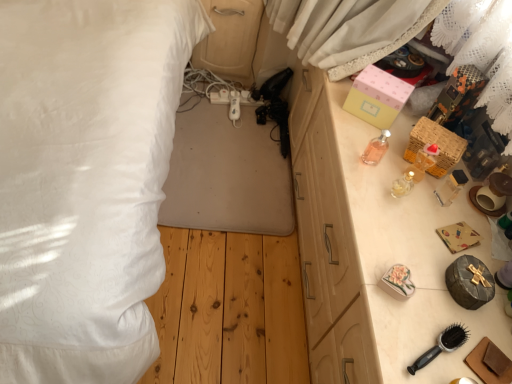
The width and height of the screenshot is (512, 384). In order to click on free spot in front of pink paper box at upper right, which ranks as the 1th box in top-to-bottom order in this screenshot , I will do `click(354, 137)`.